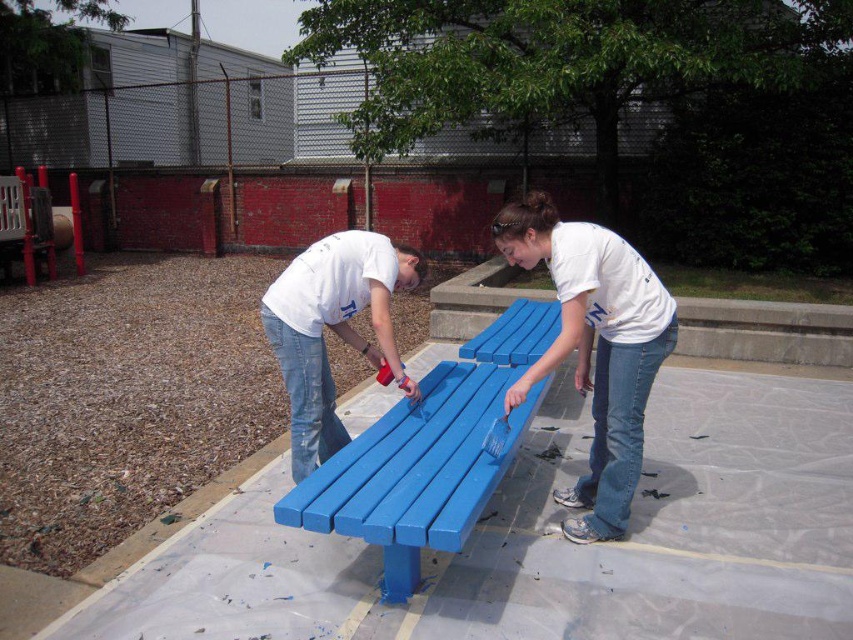
Question: Considering the relative positions of matte plastic bench at center and blue painted wood bench at center in the image provided, where is matte plastic bench at center located with respect to blue painted wood bench at center?

Choices:
 (A) below
 (B) above

Answer: (B)

Question: Is matte plastic bench at center positioned before blue painted wood bench at center?

Choices:
 (A) no
 (B) yes

Answer: (A)

Question: Is matte plastic bench at center positioned before blue painted wood bench at center?

Choices:
 (A) no
 (B) yes

Answer: (A)

Question: Which object appears closest to the camera in this image?

Choices:
 (A) matte plastic bench at center
 (B) blue painted wood bench at center

Answer: (B)

Question: Which point appears closest to the camera in this image?

Choices:
 (A) (564, 352)
 (B) (473, 406)

Answer: (A)